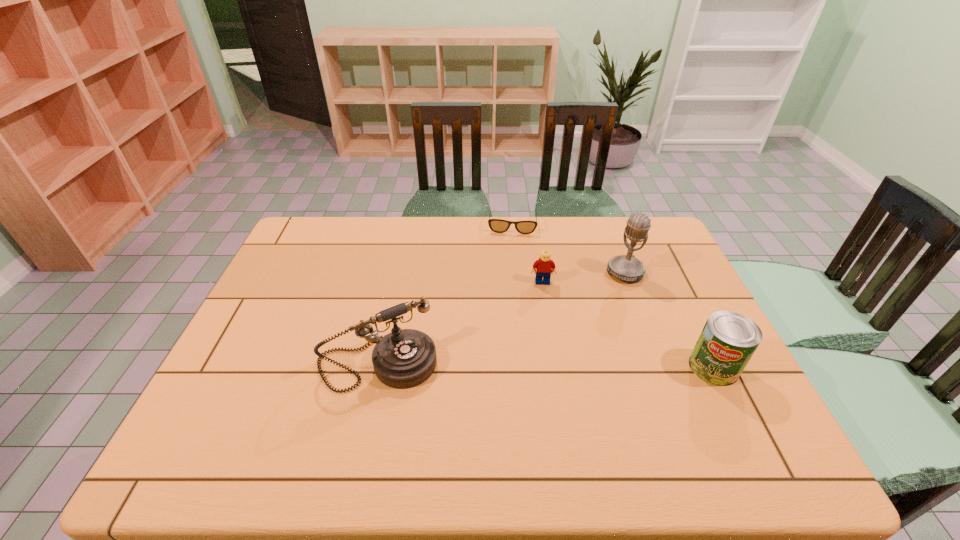
At what (x,y) coordinates should I click in order to perform the action: click on free space located on the front-facing side of the microphone. Please return your answer as a coordinate pair (x, y). This screenshot has height=540, width=960. Looking at the image, I should click on 529,347.

Where is `vacant region located on the front-facing side of the microphone`? The height and width of the screenshot is (540, 960). vacant region located on the front-facing side of the microphone is located at coordinates (594, 296).

Where is `free space located 0.350m on the front-facing side of the sunglasses`? free space located 0.350m on the front-facing side of the sunglasses is located at coordinates (506, 305).

Identify the location of vacant area situated on the front-facing side of the sunglasses. (510, 247).

In order to click on vacant area situated on the front-facing side of the sunglasses in this screenshot , I will do `click(509, 260)`.

This screenshot has width=960, height=540. I want to click on vacant region located on the front-facing side of the second shortest object, so click(x=553, y=387).

Identify the location of free space located 0.210m on the front-facing side of the second shortest object. The height and width of the screenshot is (540, 960). (547, 337).

At what (x,y) coordinates should I click in order to perform the action: click on free point located on the front-facing side of the second shortest object. Please return your answer as a coordinate pair (x, y). The image size is (960, 540). Looking at the image, I should click on (550, 363).

Find the location of a particular element. The image size is (960, 540). object present at the far edge is located at coordinates (496, 225).

The height and width of the screenshot is (540, 960). I want to click on object located at the near edge, so click(x=405, y=358).